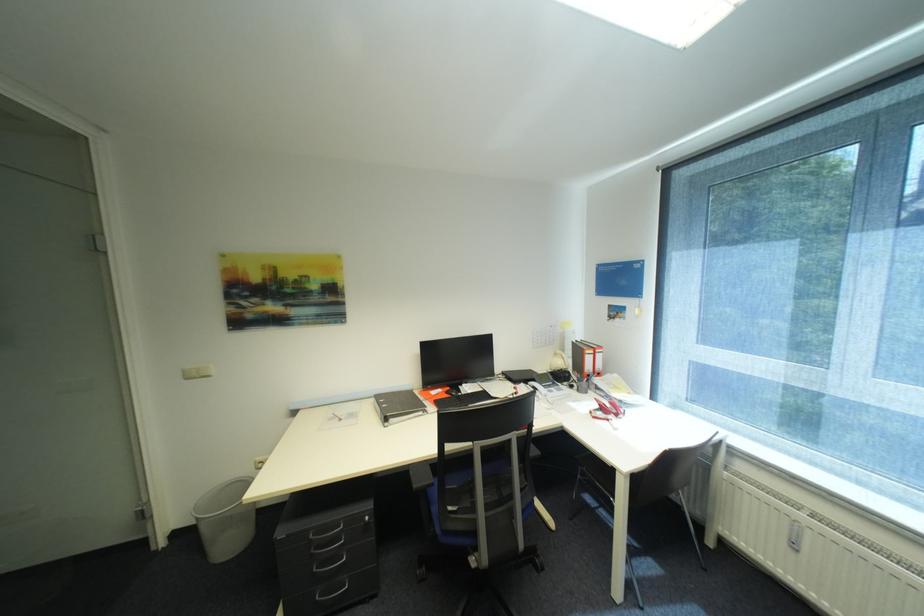
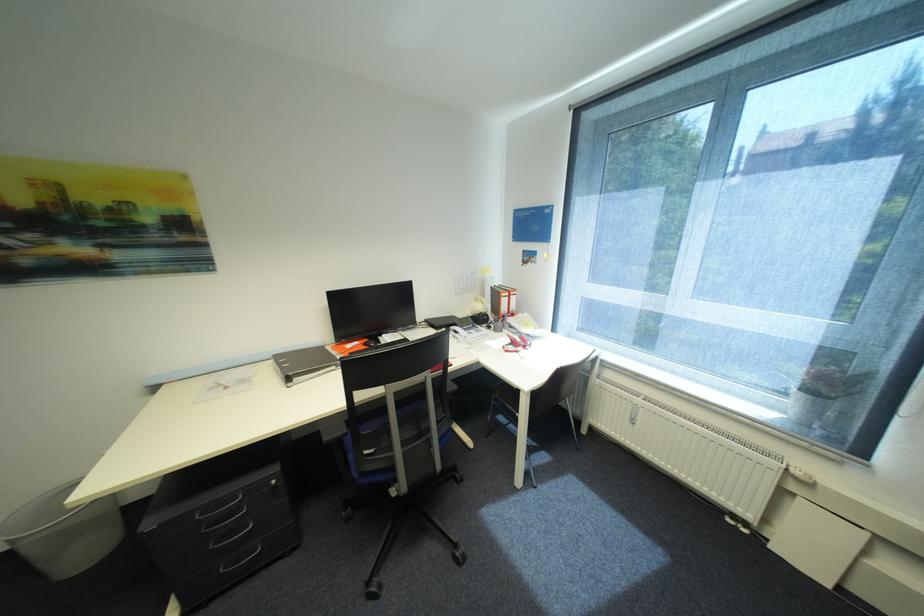
The point at (x=625, y=320) is marked in the first image. Where is the corresponding point in the second image?

(537, 265)